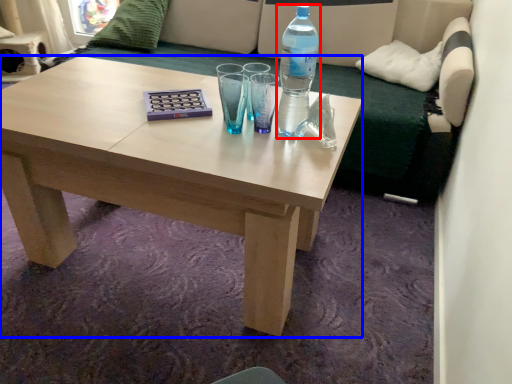
Question: Which object is closer to the camera taking this photo, bottle (highlighted by a red box) or coffee table (highlighted by a blue box)?

Choices:
 (A) bottle
 (B) coffee table

Answer: (B)